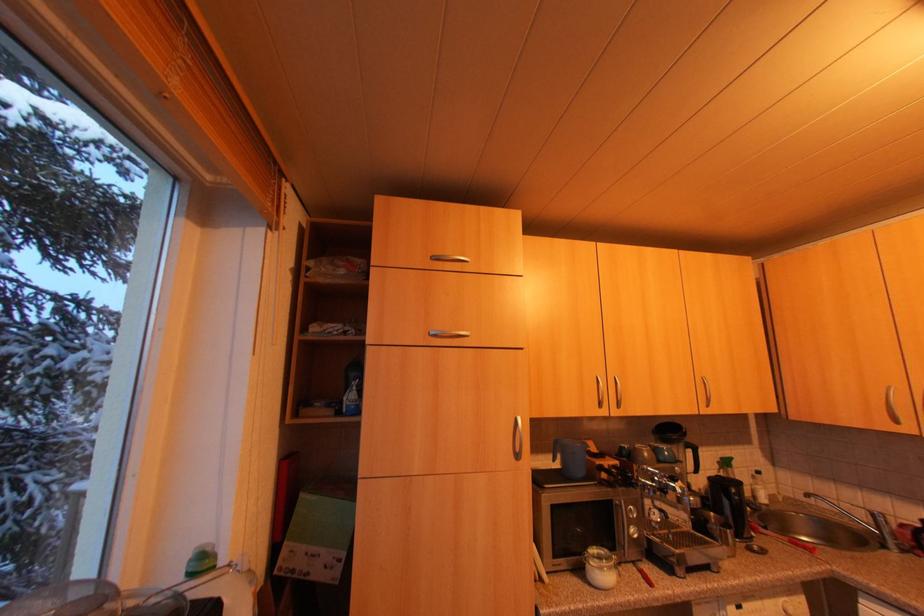
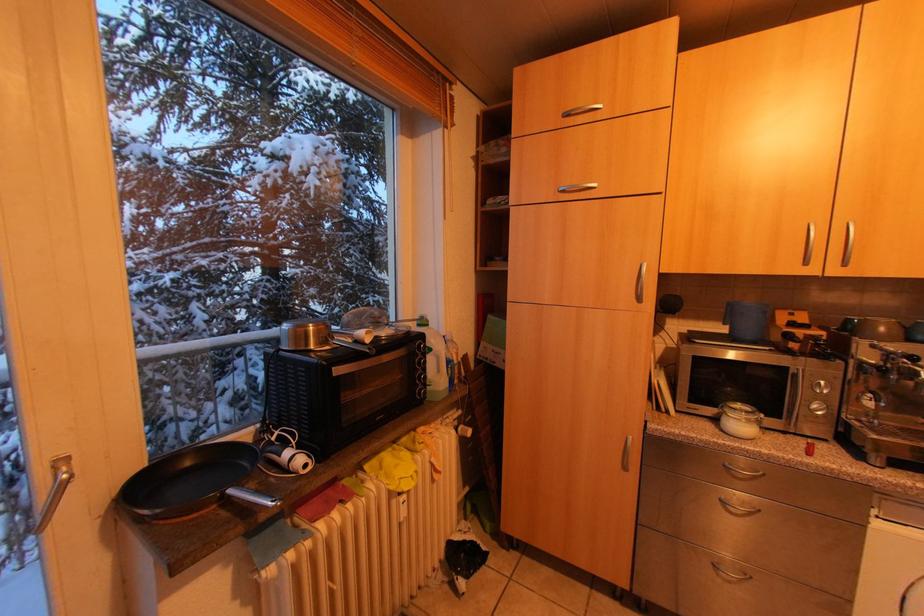
Based on the continuous images, in which direction is the camera rotating?

The camera's rotation is toward left-down.